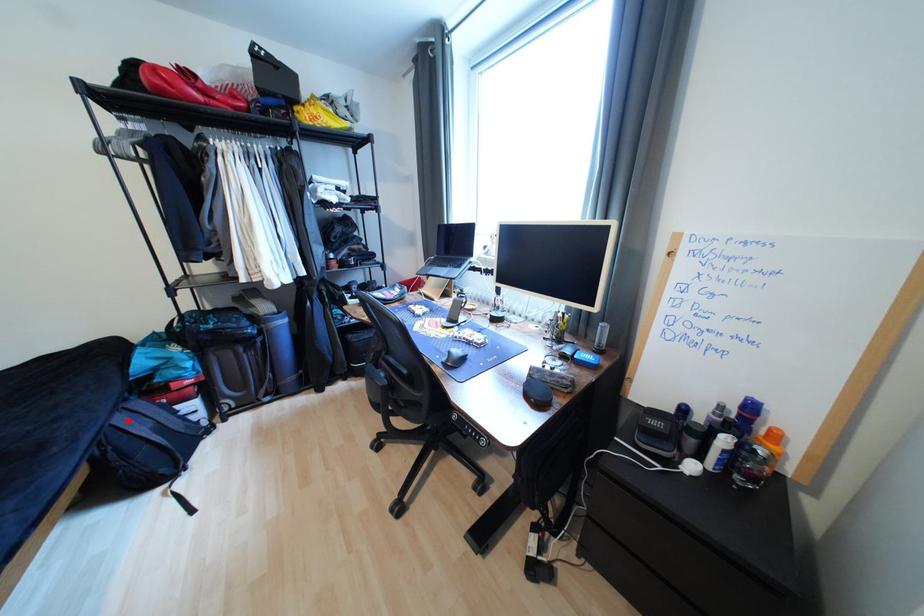
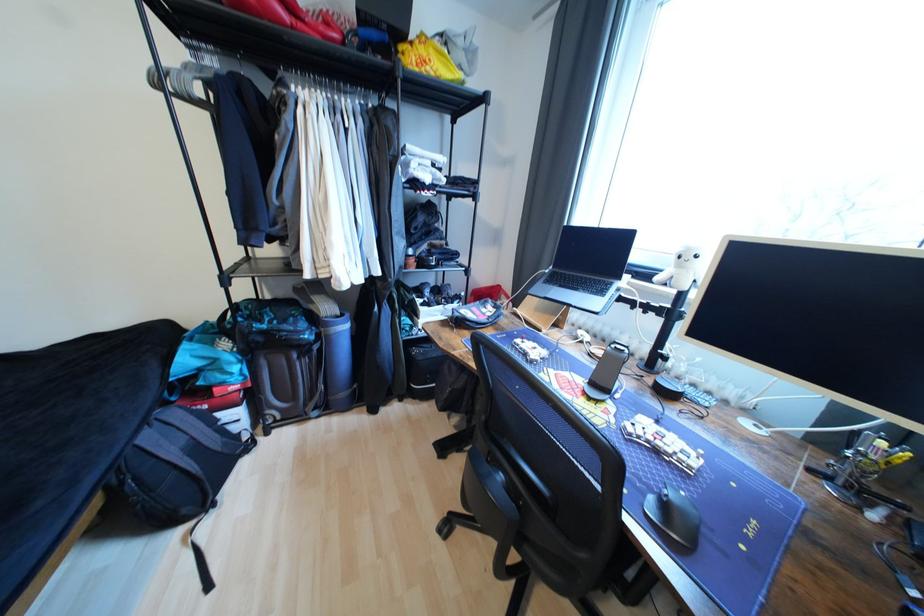
Find the pixel in the second image that matches the highlighted location in the first image.

(155, 439)